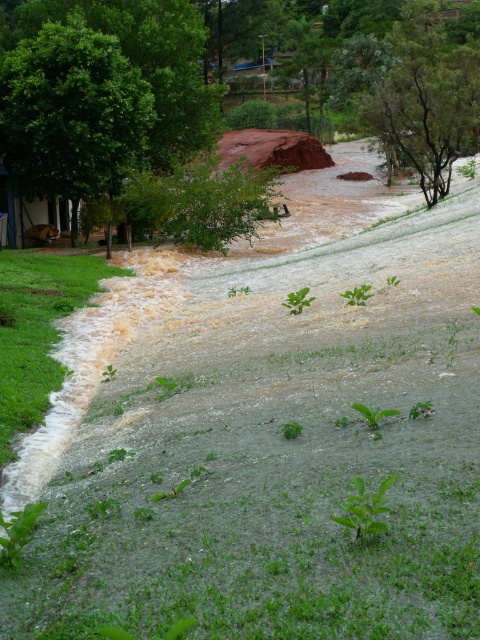
Is green leafy tree at upper left positioned in front of green leafy tree at center?

Yes, green leafy tree at upper left is in front of green leafy tree at center.

At what (x,y) coordinates should I click in order to perform the action: click on green leafy tree at upper left. Please return your answer as a coordinate pair (x, y). Looking at the image, I should click on (71, 113).

The width and height of the screenshot is (480, 640). I want to click on green leafy tree at upper left, so pyautogui.click(x=71, y=113).